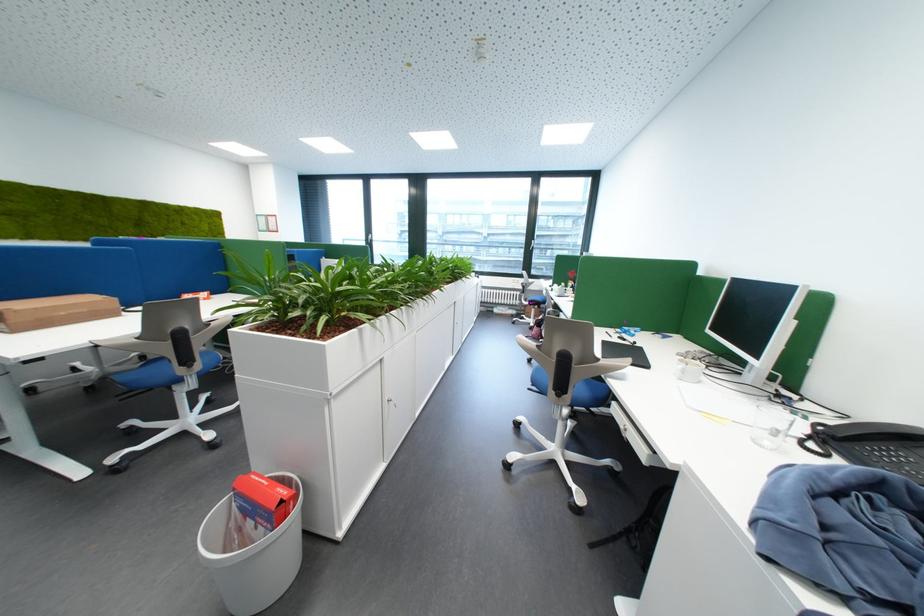
Where would you unlock the silver cabinet lock? Please return your answer as a coordinate pair (x, y).

(391, 402)